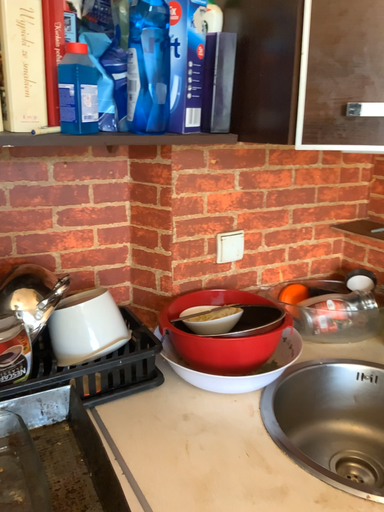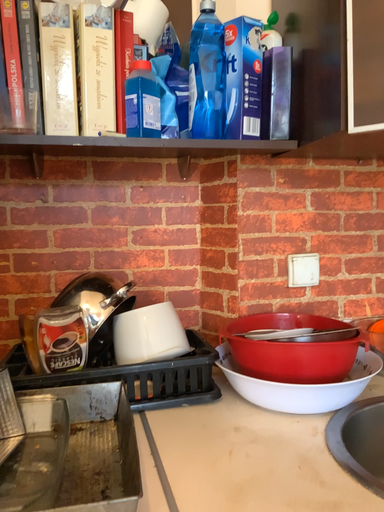
Question: Which way did the camera rotate in the video?

Choices:
 (A) rotated left
 (B) rotated right

Answer: (A)